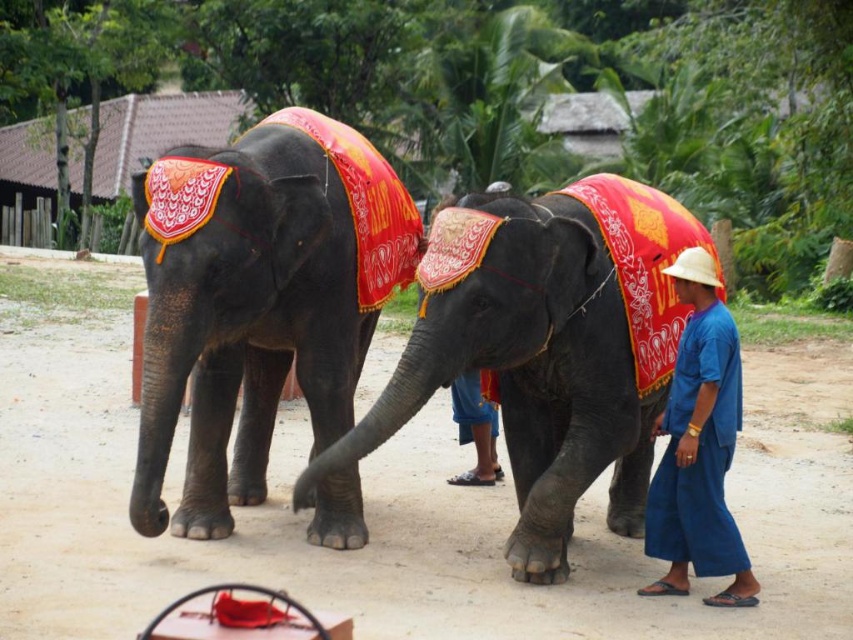
Question: Is shiny black elephant at center above blue cotton pants at lower right?

Choices:
 (A) no
 (B) yes

Answer: (B)

Question: Which object is farther from the camera taking this photo?

Choices:
 (A) shiny black elephant at center
 (B) shiny red clothed elephant at center
 (C) brown dirt track at center
 (D) blue cotton pants at lower right

Answer: (D)

Question: Does brown dirt track at center appear on the left side of shiny black elephant at center?

Choices:
 (A) yes
 (B) no

Answer: (B)

Question: Which point appears farthest from the camera in this image?

Choices:
 (A) (822, 515)
 (B) (144, 376)
 (C) (691, 360)
 (D) (631, 184)

Answer: (A)

Question: Which of these objects is positioned farthest from the brown dirt track at center?

Choices:
 (A) shiny black elephant at center
 (B) blue cotton pants at lower right
 (C) shiny red clothed elephant at center

Answer: (B)

Question: Can you confirm if shiny black elephant at center is wider than shiny red clothed elephant at center?

Choices:
 (A) no
 (B) yes

Answer: (A)